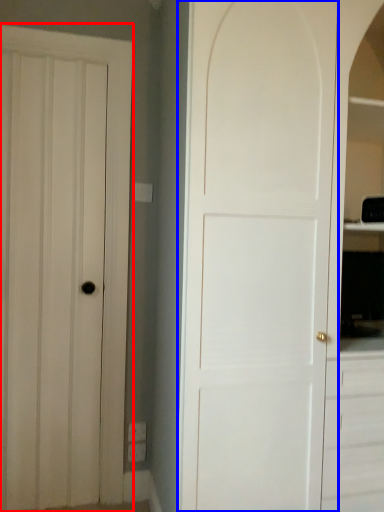
Question: Which of the following is the farthest to the observer, door (highlighted by a red box) or door (highlighted by a blue box)?

Choices:
 (A) door
 (B) door

Answer: (A)